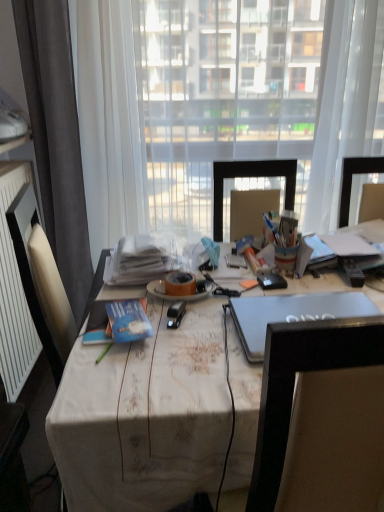
Image resolution: width=384 pixels, height=512 pixels. I want to click on free point above white fabric-covered desk at center (from a real-world perspective), so click(x=233, y=296).